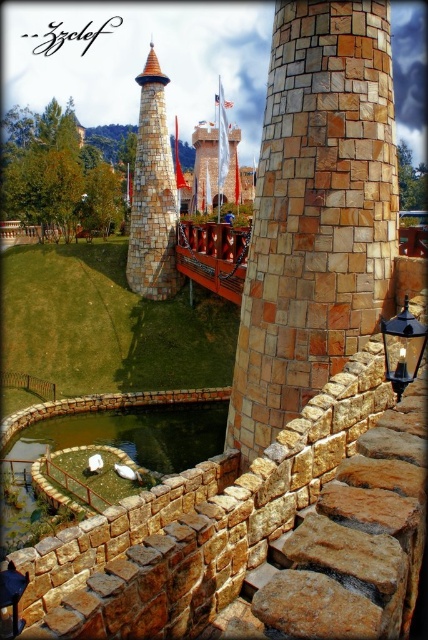
Does natural stone tower at center have a larger size compared to stone textured tower at center?

Actually, natural stone tower at center might be smaller than stone textured tower at center.

Can you confirm if natural stone tower at center is positioned to the right of stone textured tower at center?

Indeed, natural stone tower at center is positioned on the right side of stone textured tower at center.

Does point (389, 74) come behind point (136, 209)?

No, (389, 74) is closer to viewer.

Image resolution: width=428 pixels, height=640 pixels. Find the location of `natural stone tower at center`. natural stone tower at center is located at coordinates (315, 212).

Does natural stone tower at center lie in front of white stone tower at center?

That is True.

Is point (347, 257) farther from camera compared to point (234, 189)?

No.

Measure the distance between point (312, 1) and camera.

Point (312, 1) is 25.83 meters from camera.

Where is `natural stone tower at center`? natural stone tower at center is located at coordinates (315, 212).

Who is more distant from viewer, (344, 273) or (389, 336)?

The point (344, 273) is more distant.

Is natural stone tower at center wider than black metal lantern at right?

Indeed, natural stone tower at center has a greater width compared to black metal lantern at right.

Between point (353, 320) and point (392, 324), which one is positioned in front?

Point (392, 324) is in front.

This screenshot has height=640, width=428. Identify the location of natural stone tower at center. (315, 212).